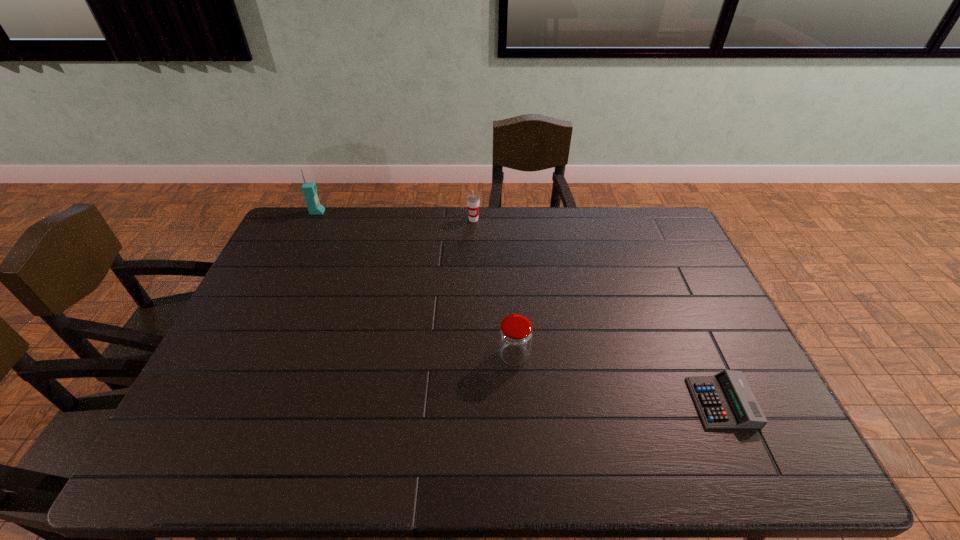
Where is `free space located on the back of the jar`? This screenshot has height=540, width=960. free space located on the back of the jar is located at coordinates (512, 321).

Identify the location of vacant space situated on the left of the calculator. The width and height of the screenshot is (960, 540). [x=606, y=402].

Locate an element on the screen. The image size is (960, 540). cellular telephone present at the far edge is located at coordinates (309, 189).

Find the location of a particular element. The image size is (960, 540). cup located in the far edge section of the desktop is located at coordinates (473, 200).

Where is `object located in the left edge section of the desktop`? object located in the left edge section of the desktop is located at coordinates (309, 189).

The image size is (960, 540). In order to click on object positioned at the right edge in this screenshot , I will do `click(725, 400)`.

This screenshot has height=540, width=960. I want to click on object that is at the far left corner, so click(309, 189).

Image resolution: width=960 pixels, height=540 pixels. In order to click on vacant region at the far edge in this screenshot , I will do `click(377, 217)`.

Where is `free space at the near edge of the desktop`? free space at the near edge of the desktop is located at coordinates (617, 447).

In order to click on vacant space at the left edge of the desktop in this screenshot , I will do `click(285, 338)`.